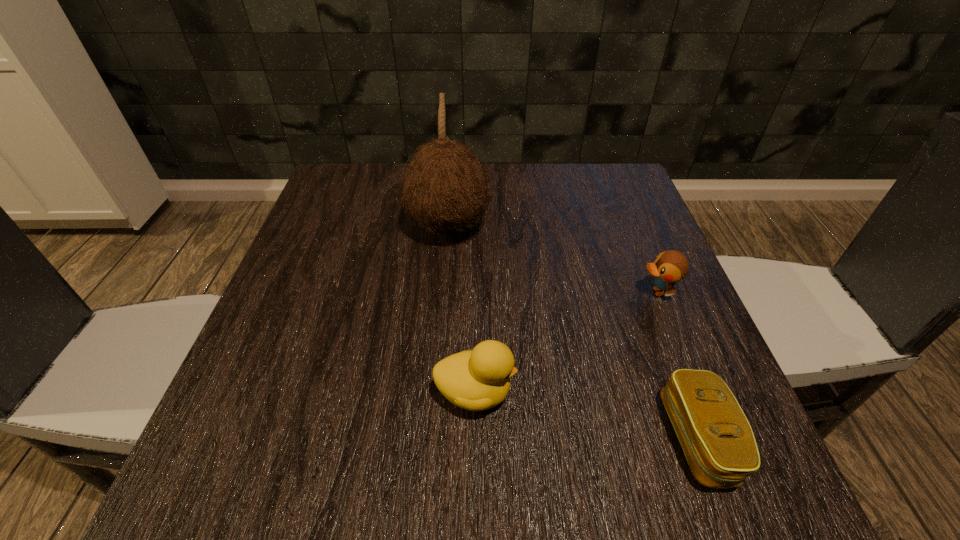
In the image, there is a desktop. At what (x,y) coordinates should I click in order to perform the action: click on free region at the far edge. Please return your answer as a coordinate pair (x, y). The width and height of the screenshot is (960, 540). Looking at the image, I should click on (560, 177).

Image resolution: width=960 pixels, height=540 pixels. In the image, there is a desktop. In order to click on vacant area at the near edge in this screenshot , I will do `click(524, 471)`.

Locate an element on the screen. The height and width of the screenshot is (540, 960). vacant space at the left edge is located at coordinates (277, 328).

Image resolution: width=960 pixels, height=540 pixels. I want to click on vacant space at the right edge, so click(660, 326).

In the image, there is a desktop. Find the location of `vacant space at the far left corner`. vacant space at the far left corner is located at coordinates (381, 210).

The height and width of the screenshot is (540, 960). Identify the location of vacant space at the near left corner of the desktop. (292, 500).

The width and height of the screenshot is (960, 540). In order to click on vacant area at the far right corner of the desktop in this screenshot , I will do `click(598, 205)`.

Where is `vacant area between the third shortest object and the coconut`? vacant area between the third shortest object and the coconut is located at coordinates (462, 309).

The height and width of the screenshot is (540, 960). Identify the location of free space between the third tallest object and the left duck. (566, 342).

In order to click on vacant area between the coconut and the left duck in this screenshot , I will do `click(462, 309)`.